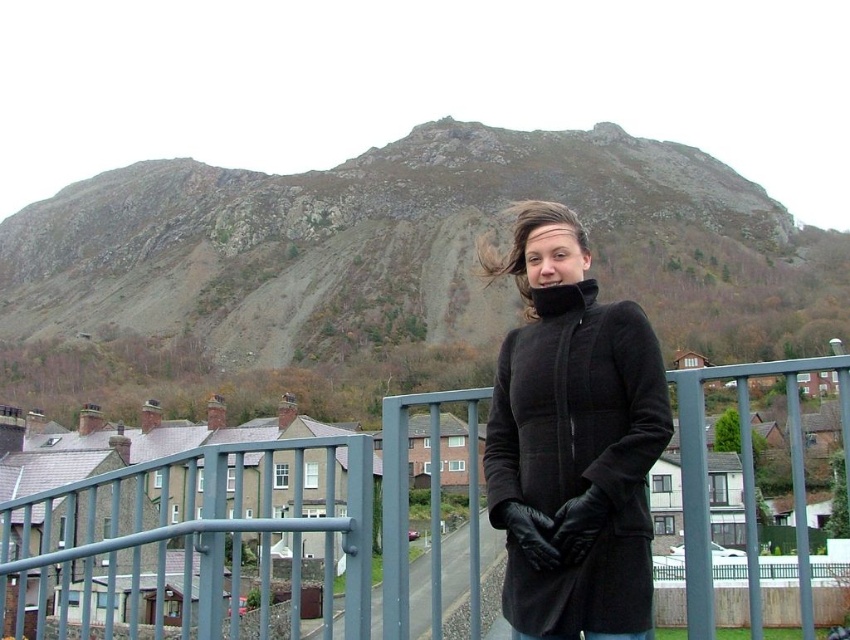
Question: Is rough stone mountain at upper center smaller than black wool coat at center?

Choices:
 (A) yes
 (B) no

Answer: (B)

Question: Which is nearer to the metallic gray fence at center?

Choices:
 (A) black wool coat at center
 (B) rough stone mountain at upper center

Answer: (A)

Question: Is rough stone mountain at upper center to the right of black wool coat at center from the viewer's perspective?

Choices:
 (A) no
 (B) yes

Answer: (A)

Question: Among these points, which one is nearest to the camera?

Choices:
 (A) (431, 221)
 (B) (204, 570)

Answer: (B)

Question: From the image, what is the correct spatial relationship of black wool coat at center in relation to metallic gray fence at center?

Choices:
 (A) right
 (B) left

Answer: (B)

Question: Which of the following is the farthest from the observer?

Choices:
 (A) (4, 614)
 (B) (434, 289)

Answer: (B)